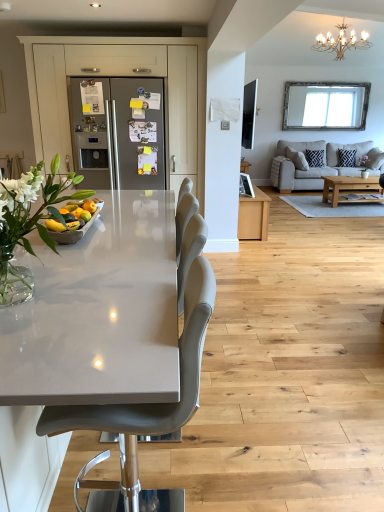
Question: Can you confirm if satin silver refrigerator at center is taller than black woven pillow at upper right, which appears as the 2th pillow when viewed from the right?

Choices:
 (A) no
 (B) yes

Answer: (B)

Question: Can you confirm if satin silver refrigerator at center is positioned to the left of black woven pillow at upper right, which is counted as the 1th pillow, starting from the left?

Choices:
 (A) no
 (B) yes

Answer: (B)

Question: Would you consider satin silver refrigerator at center to be distant from black woven pillow at upper right, which is counted as the 1th pillow, starting from the left?

Choices:
 (A) no
 (B) yes

Answer: (B)

Question: From a real-world perspective, is satin silver refrigerator at center located higher than black woven pillow at upper right, which appears as the 2th pillow when viewed from the right?

Choices:
 (A) no
 (B) yes

Answer: (B)

Question: Does satin silver refrigerator at center have a lesser height compared to black woven pillow at upper right, which is counted as the 1th pillow, starting from the left?

Choices:
 (A) yes
 (B) no

Answer: (B)

Question: From the image's perspective, is satin silver refrigerator at center beneath black woven pillow at upper right, which appears as the 2th pillow when viewed from the right?

Choices:
 (A) no
 (B) yes

Answer: (B)

Question: Considering the relative sizes of black woven pillow at upper right, which is counted as the 1th pillow, starting from the left, and satin silver refrigerator at center in the image provided, is black woven pillow at upper right, which is counted as the 1th pillow, starting from the left, thinner than satin silver refrigerator at center?

Choices:
 (A) yes
 (B) no

Answer: (A)

Question: Is black woven pillow at upper right, which appears as the 2th pillow when viewed from the right, bigger than satin silver refrigerator at center?

Choices:
 (A) yes
 (B) no

Answer: (B)

Question: Is black woven pillow at upper right, which appears as the 2th pillow when viewed from the right, wider than satin silver refrigerator at center?

Choices:
 (A) yes
 (B) no

Answer: (B)

Question: From the image's perspective, is black woven pillow at upper right, which appears as the 2th pillow when viewed from the right, beneath satin silver refrigerator at center?

Choices:
 (A) yes
 (B) no

Answer: (B)

Question: Are black woven pillow at upper right, which is counted as the 1th pillow, starting from the left, and satin silver refrigerator at center far apart?

Choices:
 (A) no
 (B) yes

Answer: (B)

Question: From the image's perspective, is black woven pillow at upper right, which is counted as the 1th pillow, starting from the left, above satin silver refrigerator at center?

Choices:
 (A) no
 (B) yes

Answer: (B)

Question: Does beige fabric couch at right come behind black woven pillow at upper right, which is counted as the 1th pillow, starting from the left?

Choices:
 (A) yes
 (B) no

Answer: (B)